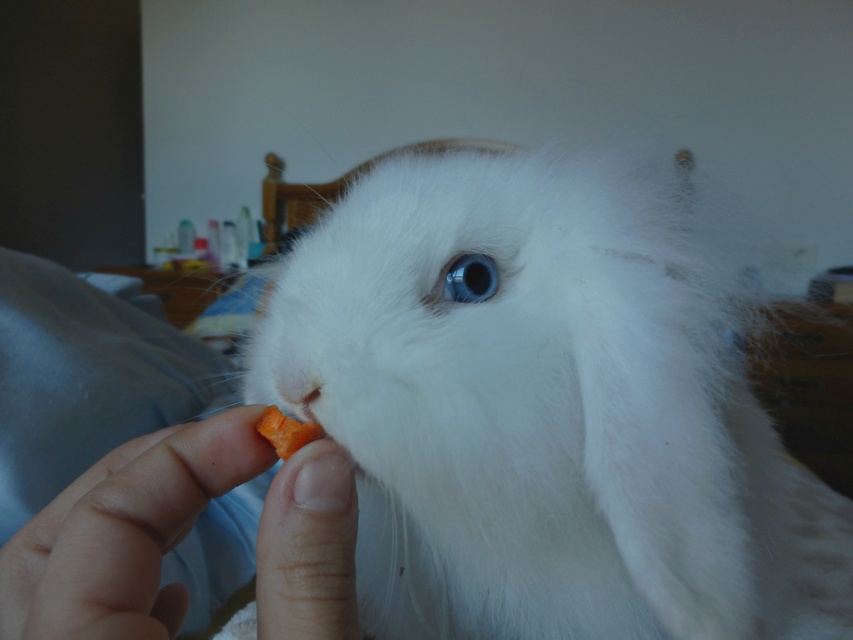
You are a photographer trying to capture the white fluffy rabbit at center in the center of your photo. Based on its current position at point 0.648, 0.639, will you need to adjust your camera to the left or right to center the rabbit?

The white fluffy rabbit at center is already positioned at the specified coordinates, so no adjustment is needed to center it.

You are a veterinarian examining a patient. You notice the white fluffy rabbit at center and the smooth skin at lower left in the image. Which object is located below the other?

The white fluffy rabbit at center is positioned under smooth skin at lower left, so the smooth skin at lower left is above the rabbit.

Looking at the scene, where is the white fluffy rabbit at center in relation to the smooth skin at lower left?

The white fluffy rabbit at center is to the right of the smooth skin at lower left.